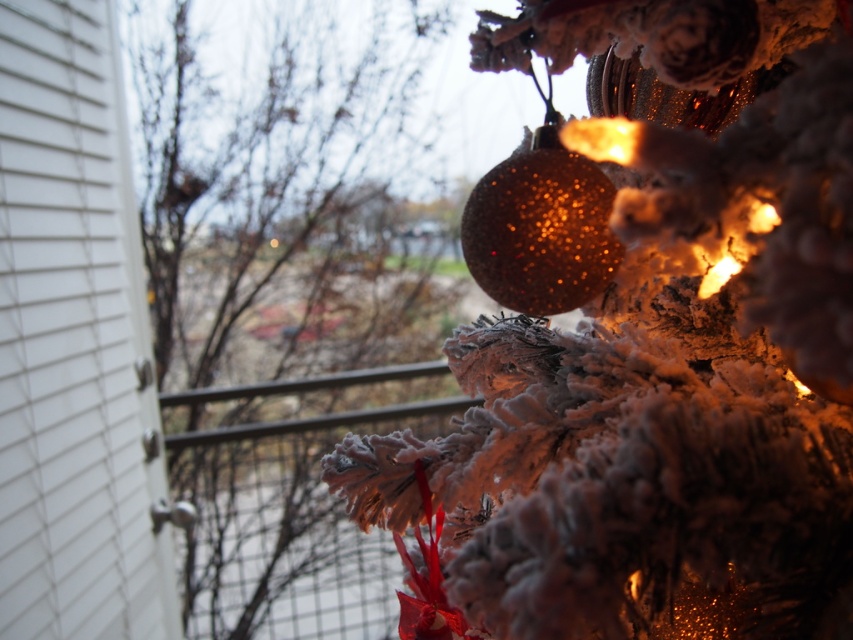
Who is positioned more to the right, sparkling gold ornament at upper right or white textured siding at left?

sparkling gold ornament at upper right is more to the right.

Does sparkling gold ornament at upper right appear over white textured siding at left?

Yes, sparkling gold ornament at upper right is above white textured siding at left.

What do you see at coordinates (659, 353) in the screenshot?
I see `sparkling gold ornament at upper right` at bounding box center [659, 353].

Locate an element on the screen. The height and width of the screenshot is (640, 853). sparkling gold ornament at upper right is located at coordinates (659, 353).

Can you confirm if sparkling gold ornament at upper right is bigger than frosted pine cone at right?

Actually, sparkling gold ornament at upper right might be smaller than frosted pine cone at right.

Which is more to the left, sparkling gold ornament at upper right or frosted pine cone at right?

From the viewer's perspective, frosted pine cone at right appears more on the left side.

Where is `sparkling gold ornament at upper right`? The width and height of the screenshot is (853, 640). sparkling gold ornament at upper right is located at coordinates (659, 353).

Who is more forward, (x=79, y=595) or (x=486, y=285)?

Point (x=486, y=285)

You are a GUI agent. You are given a task and a screenshot of the screen. Output one action in this format:
    pyautogui.click(x=<x>, y=<y>)
    Task: Click on the white textured siding at left
    The width and height of the screenshot is (853, 640).
    Given the screenshot: What is the action you would take?
    pyautogui.click(x=73, y=340)